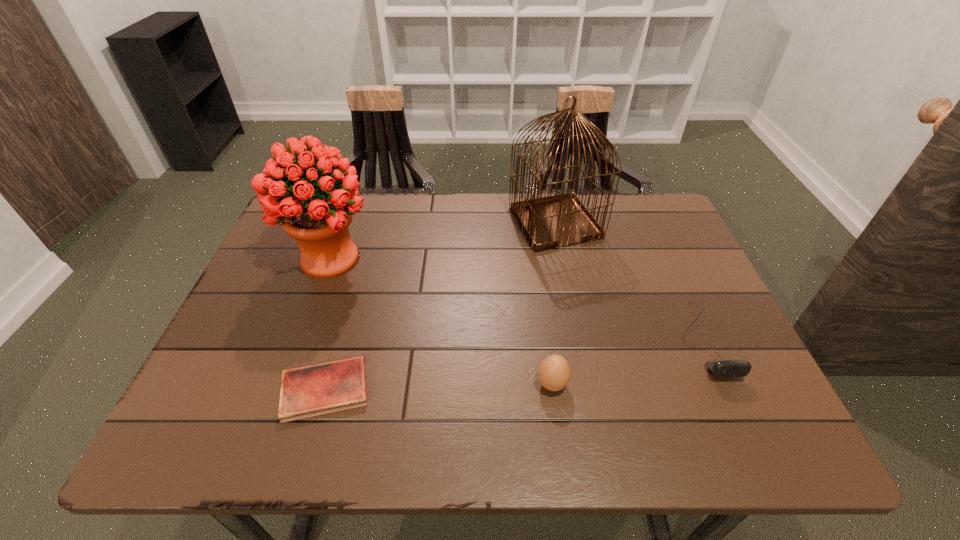
You are a GUI agent. You are given a task and a screenshot of the screen. Output one action in this format:
    pyautogui.click(x=<x>, y=<y>)
    Task: Click on the vacant area that lies between the third shortest object and the birdcage
    Image resolution: width=960 pixels, height=540 pixels.
    Given the screenshot: What is the action you would take?
    pyautogui.click(x=554, y=303)

Image resolution: width=960 pixels, height=540 pixels. Identify the location of vacant area between the birdcage and the boiled egg. (554, 303).

Where is `empty space between the bouquet and the second shortest object`? The height and width of the screenshot is (540, 960). empty space between the bouquet and the second shortest object is located at coordinates (516, 299).

Where is `free point between the bouquet and the third tallest object`? Image resolution: width=960 pixels, height=540 pixels. free point between the bouquet and the third tallest object is located at coordinates [x=442, y=321].

Select which object appears as the closest to the birdcage. Please provide its 2D coordinates. Your answer should be formatted as a tuple, i.e. [(x, y)], where the tuple contains the x and y coordinates of a point satisfying the conditions above.

[(725, 368)]

Identify which object is the third nearest to the third shortest object. Please provide its 2D coordinates. Your answer should be formatted as a tuple, i.e. [(x, y)], where the tuple contains the x and y coordinates of a point satisfying the conditions above.

[(547, 222)]

Locate an element on the screen. The width and height of the screenshot is (960, 540). vacant area that satisfies the following two spatial constraints: 1. on the front side of the boiled egg; 2. on the right side of the bouquet is located at coordinates (285, 384).

Find the location of a particular element. Image resolution: width=960 pixels, height=540 pixels. vacant point that satisfies the following two spatial constraints: 1. on the front side of the boiled egg; 2. on the left side of the bouquet is located at coordinates (285, 384).